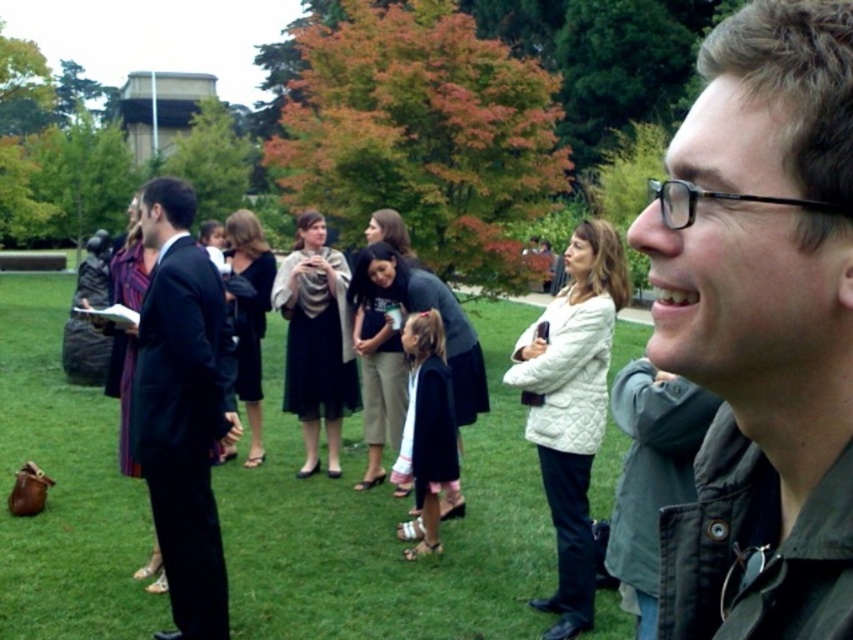
Who is lower down, dark green jacket at center or dark blue fabric dress at center?

dark blue fabric dress at center is below.

From the picture: Which is more to the left, dark green jacket at center or dark blue fabric dress at center?

dark blue fabric dress at center

Is point (788, 468) positioned before point (437, 444)?

Yes, it is.

The width and height of the screenshot is (853, 640). Identify the location of dark green jacket at center. (761, 326).

Measure the distance between dark green jacket at center and dark gray sweater at center.

dark green jacket at center is 5.18 meters away from dark gray sweater at center.

Does dark green jacket at center have a smaller size compared to dark gray sweater at center?

Indeed, dark green jacket at center has a smaller size compared to dark gray sweater at center.

What do you see at coordinates (761, 326) in the screenshot? This screenshot has width=853, height=640. I see `dark green jacket at center` at bounding box center [761, 326].

Image resolution: width=853 pixels, height=640 pixels. Identify the location of dark green jacket at center. (761, 326).

Which is in front, point (468, 481) or point (581, 339)?

Positioned in front is point (581, 339).

Between point (369, 589) and point (585, 316), which one is positioned behind?

Point (369, 589)

Is point (486, 458) farther from camera compared to point (567, 499)?

Yes.

This screenshot has width=853, height=640. What are the coordinates of `green grass at center` in the screenshot? It's located at (387, 525).